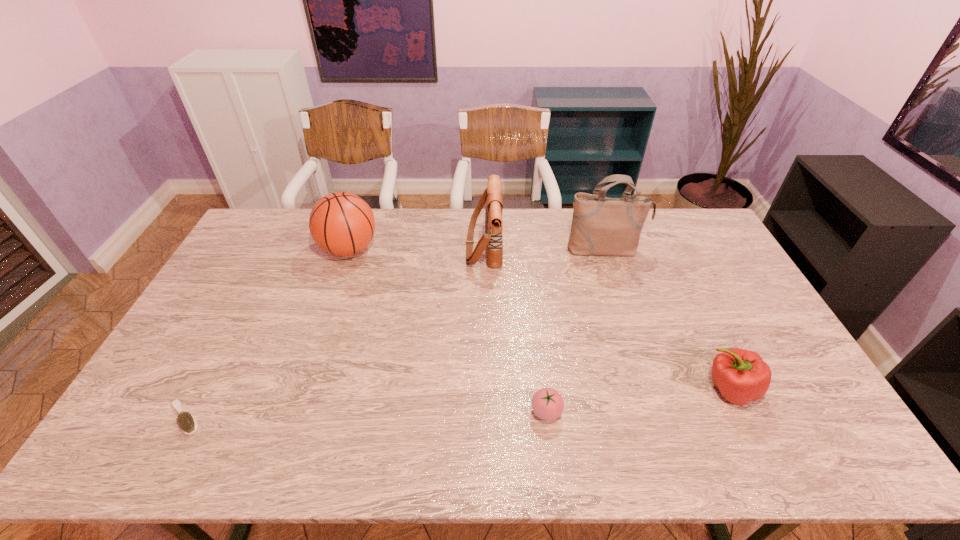
Where is `free space between the shorter shoulder bag and the bell pepper`? The width and height of the screenshot is (960, 540). free space between the shorter shoulder bag and the bell pepper is located at coordinates (607, 317).

Locate which object is the second closest to the tomato. Please provide its 2D coordinates. Your answer should be formatted as a tuple, i.e. [(x, y)], where the tuple contains the x and y coordinates of a point satisfying the conditions above.

[(492, 240)]

Identify which object is located as the second nearest to the right shoulder bag. Please provide its 2D coordinates. Your answer should be formatted as a tuple, i.e. [(x, y)], where the tuple contains the x and y coordinates of a point satisfying the conditions above.

[(741, 376)]

Locate an element on the screen. The image size is (960, 540). vacant region that satisfies the following two spatial constraints: 1. on the front-facing side of the left shoulder bag; 2. on the right side of the fourth object from left to right is located at coordinates (485, 411).

The width and height of the screenshot is (960, 540). Find the location of `vacant space that satisfies the following two spatial constraints: 1. on the front-facing side of the shorter shoulder bag; 2. on the right side of the rightmost object`. vacant space that satisfies the following two spatial constraints: 1. on the front-facing side of the shorter shoulder bag; 2. on the right side of the rightmost object is located at coordinates (485, 389).

In order to click on free space that satisfies the following two spatial constraints: 1. on the front-facing side of the third object from right to left; 2. on the right side of the left shoulder bag in this screenshot , I will do `click(485, 411)`.

You are a GUI agent. You are given a task and a screenshot of the screen. Output one action in this format:
    pyautogui.click(x=<x>, y=<y>)
    Task: Click on the vacant position in the image that satisfies the following two spatial constraints: 1. on the front-facing side of the fifth object from left to right; 2. on the left side of the rightmost object
    This screenshot has width=960, height=540.
    Given the screenshot: What is the action you would take?
    pyautogui.click(x=651, y=389)

You are a GUI agent. You are given a task and a screenshot of the screen. Output one action in this format:
    pyautogui.click(x=<x>, y=<y>)
    Task: Click on the vacant space that satisfies the following two spatial constraints: 1. on the back side of the bell pepper; 2. on the front-facing side of the shorter shoulder bag
    
    Given the screenshot: What is the action you would take?
    pyautogui.click(x=661, y=245)